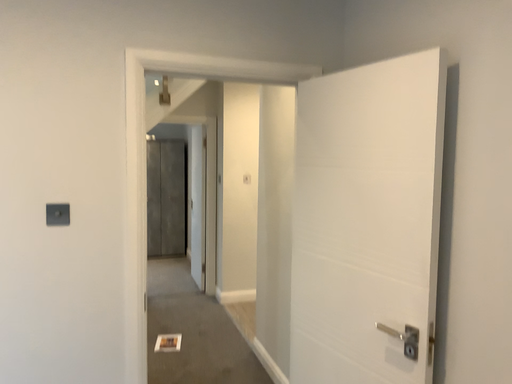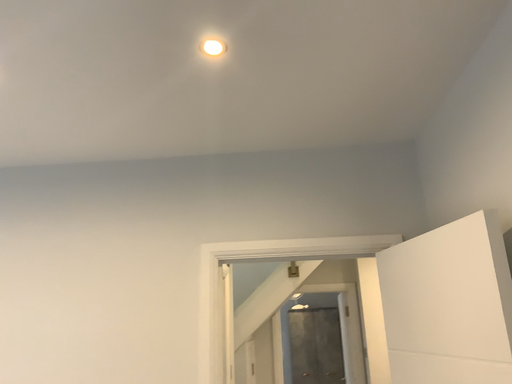
Question: How did the camera likely rotate when shooting the video?

Choices:
 (A) rotated right
 (B) rotated left

Answer: (B)